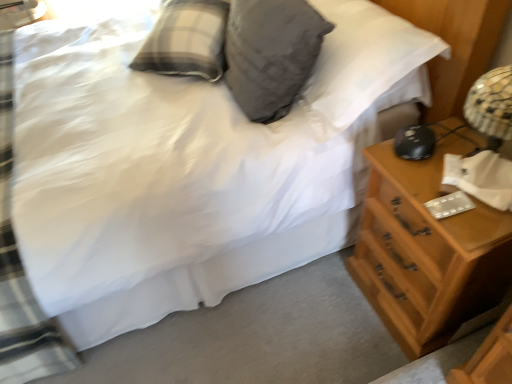
What do you see at coordinates (271, 54) in the screenshot?
I see `gray soft pillow at upper center` at bounding box center [271, 54].

The height and width of the screenshot is (384, 512). I want to click on gray soft pillow at upper center, so click(271, 54).

This screenshot has width=512, height=384. What do you see at coordinates (426, 250) in the screenshot? I see `wooden chest of drawers at right` at bounding box center [426, 250].

In order to click on wooden chest of drawers at right in this screenshot , I will do `click(426, 250)`.

In order to face wooden chest of drawers at right, should I rotate leftwards or rightwards?

A 22.518 degree turn to the right will do.

What is the approximate width of wooden chest of drawers at right?

wooden chest of drawers at right is 34.20 centimeters in width.

The image size is (512, 384). Find the location of `gray soft pillow at upper center`. gray soft pillow at upper center is located at coordinates (271, 54).

Can you confirm if gray soft pillow at upper center is positioned to the left of wooden chest of drawers at right?

Correct, you'll find gray soft pillow at upper center to the left of wooden chest of drawers at right.

Between gray soft pillow at upper center and wooden chest of drawers at right, which one is positioned behind?

gray soft pillow at upper center is further away from the camera.

Which is farther, (312, 29) or (457, 222)?

The point (312, 29) is farther.

From the image's perspective, is gray soft pillow at upper center under wooden chest of drawers at right?

No.

From a real-world perspective, is gray soft pillow at upper center under wooden chest of drawers at right?

No.

Considering the relative sizes of gray soft pillow at upper center and wooden chest of drawers at right in the image provided, is gray soft pillow at upper center thinner than wooden chest of drawers at right?

Yes.

Is gray soft pillow at upper center taller than wooden chest of drawers at right?

No.

Is gray soft pillow at upper center smaller than wooden chest of drawers at right?

Indeed, gray soft pillow at upper center has a smaller size compared to wooden chest of drawers at right.

Would you say gray soft pillow at upper center contains wooden chest of drawers at right?

That's incorrect, wooden chest of drawers at right is not inside gray soft pillow at upper center.

Is gray soft pillow at upper center with wooden chest of drawers at right?

No, gray soft pillow at upper center is not next to wooden chest of drawers at right.

Is gray soft pillow at upper center oriented away from wooden chest of drawers at right?

No, gray soft pillow at upper center's orientation is not away from wooden chest of drawers at right.

How many degrees apart are the facing directions of gray soft pillow at upper center and wooden chest of drawers at right?

There is a 6.28-degree angle between the facing directions of gray soft pillow at upper center and wooden chest of drawers at right.

Measure the distance between gray soft pillow at upper center and wooden chest of drawers at right.

gray soft pillow at upper center and wooden chest of drawers at right are 22.16 inches apart.

Identify the location of the chest of drawers that is below the gray soft pillow at upper center (from the image's perspective). The width and height of the screenshot is (512, 384). (426, 250).

Which is more to the left, wooden chest of drawers at right or gray soft pillow at upper center?

gray soft pillow at upper center.

Considering the positions of objects wooden chest of drawers at right and gray soft pillow at upper center in the image provided, who is in front, wooden chest of drawers at right or gray soft pillow at upper center?

wooden chest of drawers at right is more forward.

Is point (444, 323) positioned behind point (276, 80)?

No, (444, 323) is closer to viewer.

From the image's perspective, is wooden chest of drawers at right below gray soft pillow at upper center?

Correct, wooden chest of drawers at right appears lower than gray soft pillow at upper center in the image.

Consider the image. From a real-world perspective, is wooden chest of drawers at right physically located above or below gray soft pillow at upper center?

wooden chest of drawers at right is below gray soft pillow at upper center.

Is wooden chest of drawers at right wider than gray soft pillow at upper center?

Indeed, wooden chest of drawers at right has a greater width compared to gray soft pillow at upper center.

Considering the sizes of objects wooden chest of drawers at right and gray soft pillow at upper center in the image provided, who is shorter, wooden chest of drawers at right or gray soft pillow at upper center?

With less height is gray soft pillow at upper center.

Between wooden chest of drawers at right and gray soft pillow at upper center, which one has smaller size?

Smaller between the two is gray soft pillow at upper center.

Is wooden chest of drawers at right not within gray soft pillow at upper center?

That's correct, wooden chest of drawers at right is outside of gray soft pillow at upper center.

Is there a large distance between wooden chest of drawers at right and gray soft pillow at upper center?

No, wooden chest of drawers at right is not far away from gray soft pillow at upper center.

Could you tell me if wooden chest of drawers at right is facing gray soft pillow at upper center?

No, wooden chest of drawers at right is not oriented towards gray soft pillow at upper center.

Where is `pillow behind the wooden chest of drawers at right`? This screenshot has height=384, width=512. pillow behind the wooden chest of drawers at right is located at coordinates (271, 54).

Find the location of a particular element. The height and width of the screenshot is (384, 512). chest of drawers on the right of gray soft pillow at upper center is located at coordinates (426, 250).

Identify the location of pillow behind the wooden chest of drawers at right. This screenshot has width=512, height=384. (271, 54).